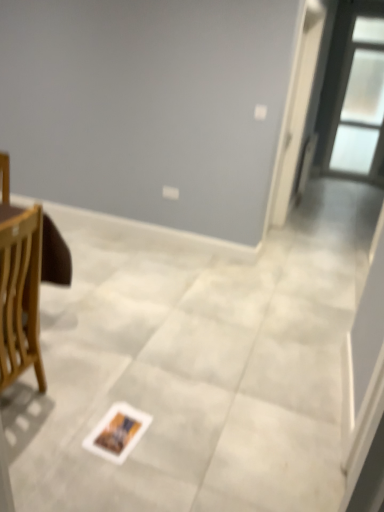
The image size is (384, 512). What are the coordinates of `free point to the right of white paper postcard at center` in the screenshot? It's located at (169, 428).